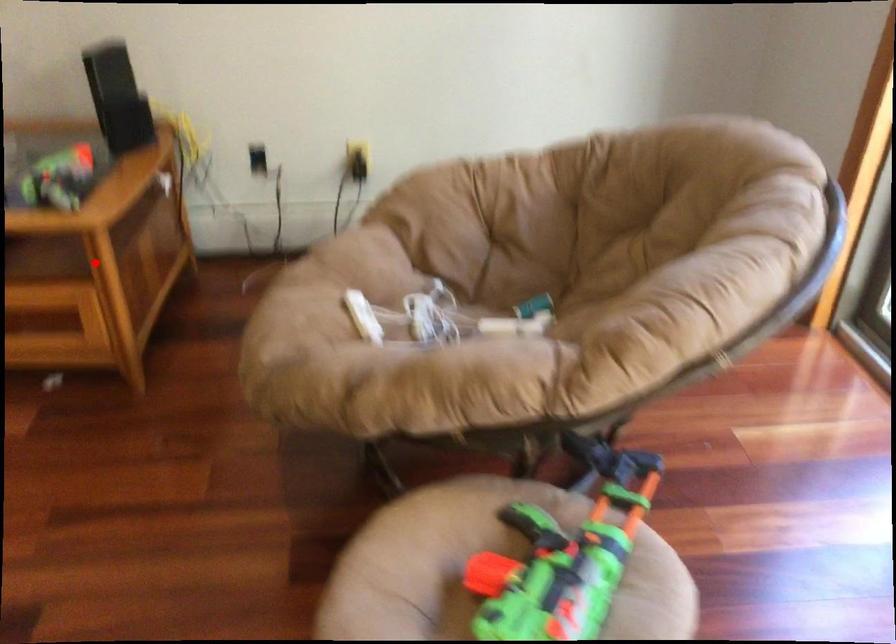
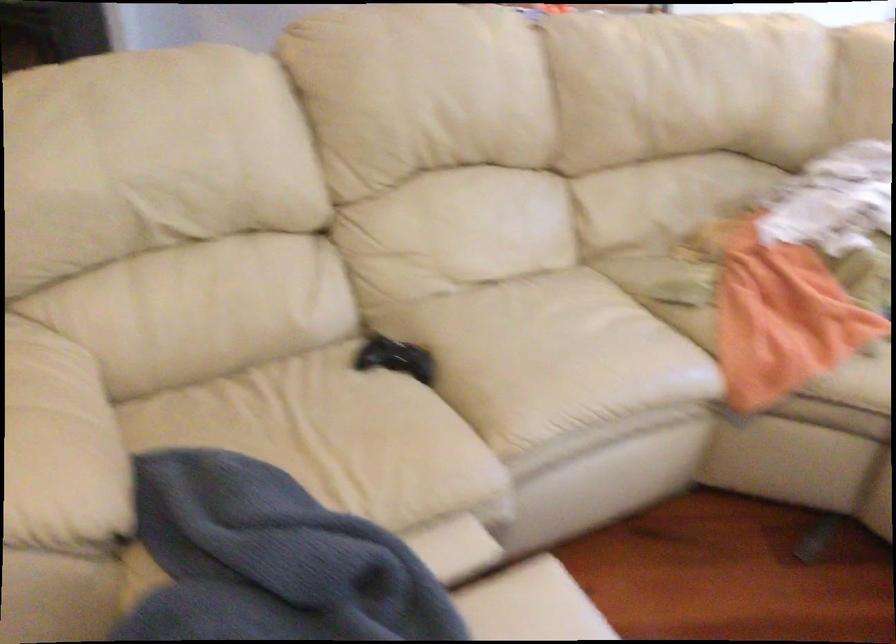
Question: I am providing you with two images of the same scene from different viewpoints. A red point is marked on the first image. Is the red point's position out of view in image 2?

Choices:
 (A) Yes
 (B) No

Answer: (A)